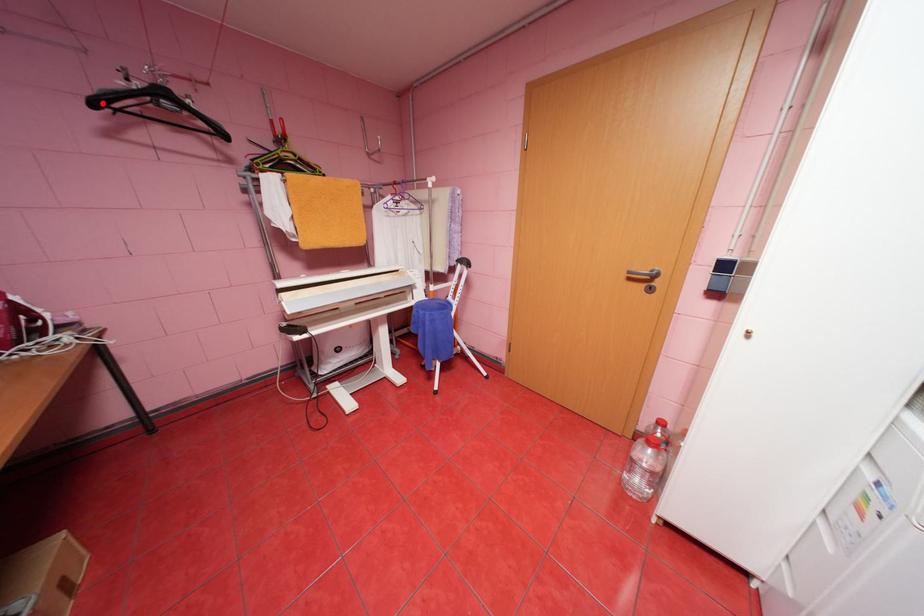
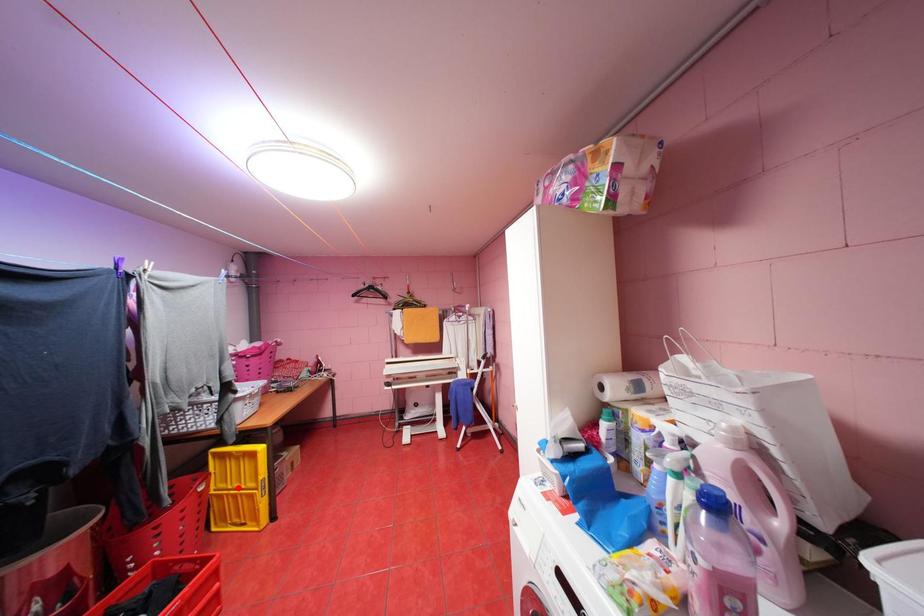
I am providing you with two images of the same scene from different viewpoints. A red point is marked on the first image and another point is marked on the second image. Are the points marked in image1 and image2 representing the same 3D position?

No